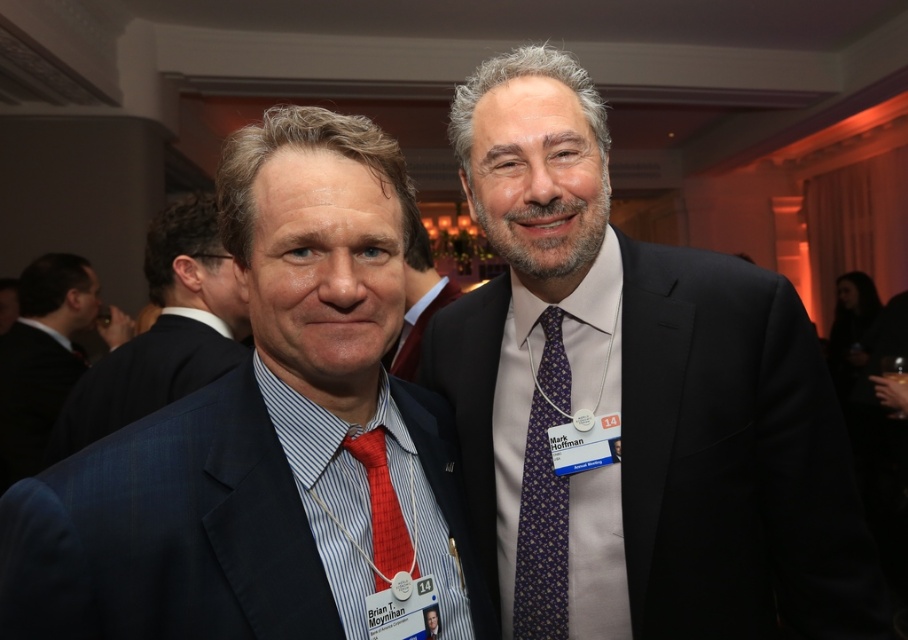
Who is shorter, blue textured suit at left or matte black suit at left?

blue textured suit at left

Is point (193, 358) positioned behind point (50, 337)?

No, (193, 358) is in front of (50, 337).

Does point (184, 333) lie behind point (94, 296)?

No, (184, 333) is in front of (94, 296).

Find the location of `blue textured suit at left`. blue textured suit at left is located at coordinates [x=163, y=332].

Can you confirm if dark gray suit at right is positioned to the right of purple silk tie at right?

Correct, you'll find dark gray suit at right to the right of purple silk tie at right.

Does dark gray suit at right come behind purple silk tie at right?

No, it is not.

Locate an element on the screen. dark gray suit at right is located at coordinates (635, 401).

I want to click on dark gray suit at right, so click(635, 401).

Is dark gray suit at right taller than matte black suit at center?

Yes, dark gray suit at right is taller than matte black suit at center.

Describe the element at coordinates (635, 401) in the screenshot. I see `dark gray suit at right` at that location.

The image size is (908, 640). In order to click on dark gray suit at right in this screenshot , I will do `click(635, 401)`.